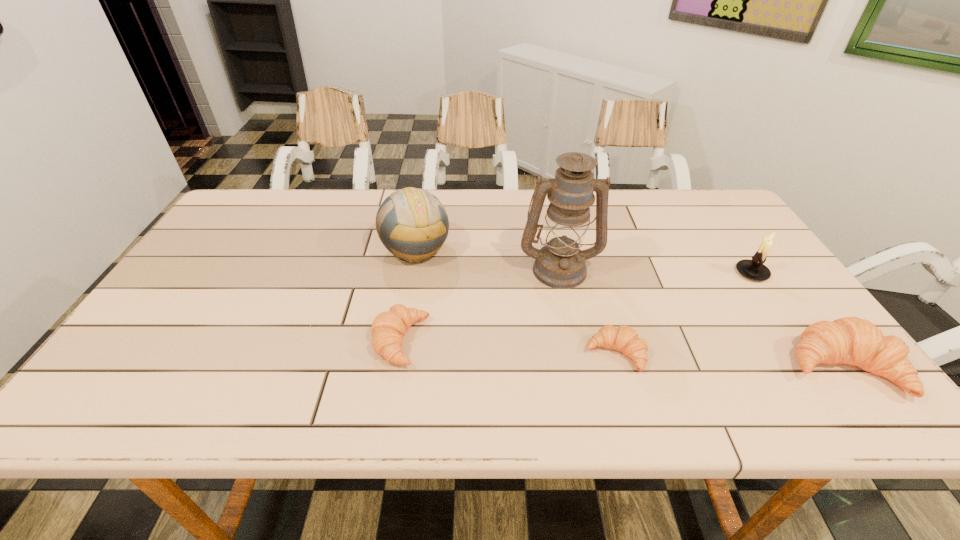
In order to click on free location that satisfies the following two spatial constraints: 1. on the front side of the tallest object; 2. on the right side of the shortest crescent roll in this screenshot , I will do `click(576, 354)`.

The image size is (960, 540). I want to click on blank area in the image that satisfies the following two spatial constraints: 1. on the front side of the second crescent roll from left to right; 2. on the right side of the fourth tallest object, so click(619, 367).